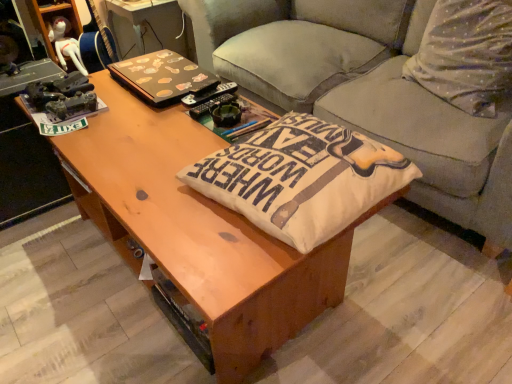
Question: Does gray fabric couch at center have a larger size compared to white cotton pillow at upper right, marked as the second throw pillow in a left-to-right arrangement?

Choices:
 (A) yes
 (B) no

Answer: (A)

Question: Is gray fabric couch at center thinner than white cotton pillow at upper right, the first throw pillow viewed from the right?

Choices:
 (A) yes
 (B) no

Answer: (B)

Question: From a real-world perspective, is gray fabric couch at center beneath white cotton pillow at upper right, which is the second throw pillow from bottom to top?

Choices:
 (A) no
 (B) yes

Answer: (B)

Question: Considering the relative sizes of gray fabric couch at center and white cotton pillow at upper right, acting as the first throw pillow starting from the back, in the image provided, is gray fabric couch at center shorter than white cotton pillow at upper right, acting as the first throw pillow starting from the back,?

Choices:
 (A) no
 (B) yes

Answer: (A)

Question: Considering the relative sizes of gray fabric couch at center and white cotton pillow at upper right, which is the second throw pillow from bottom to top, in the image provided, is gray fabric couch at center smaller than white cotton pillow at upper right, which is the second throw pillow from bottom to top,?

Choices:
 (A) no
 (B) yes

Answer: (A)

Question: Considering the positions of point (313, 147) and point (263, 21), is point (313, 147) closer or farther from the camera than point (263, 21)?

Choices:
 (A) farther
 (B) closer

Answer: (B)

Question: Considering their positions, is beige fabric cushion at center, marked as the 2th throw pillow in a top-to-bottom arrangement, located in front of or behind gray fabric couch at center?

Choices:
 (A) behind
 (B) front

Answer: (B)

Question: Considering the positions of beige fabric cushion at center, marked as the first throw pillow in a bottom-to-top arrangement, and gray fabric couch at center in the image, is beige fabric cushion at center, marked as the first throw pillow in a bottom-to-top arrangement, wider or thinner than gray fabric couch at center?

Choices:
 (A) thin
 (B) wide

Answer: (A)

Question: Based on their sizes in the image, would you say beige fabric cushion at center, which is the 1th throw pillow from front to back, is bigger or smaller than gray fabric couch at center?

Choices:
 (A) big
 (B) small

Answer: (B)

Question: In terms of width, does brown matte laptop at upper center look wider or thinner when compared to white cotton pillow at upper right, which is the second throw pillow from bottom to top?

Choices:
 (A) thin
 (B) wide

Answer: (B)

Question: Is point (207, 82) closer or farther from the camera than point (458, 92)?

Choices:
 (A) farther
 (B) closer

Answer: (B)

Question: In terms of height, does brown matte laptop at upper center look taller or shorter compared to white cotton pillow at upper right, the first throw pillow viewed from the right?

Choices:
 (A) short
 (B) tall

Answer: (A)

Question: Considering the relative positions of brown matte laptop at upper center and white cotton pillow at upper right, which appears as the 1th throw pillow when viewed from the top, in the image provided, is brown matte laptop at upper center to the left or to the right of white cotton pillow at upper right, which appears as the 1th throw pillow when viewed from the top,?

Choices:
 (A) left
 (B) right

Answer: (A)

Question: Would you say white cotton pillow at upper right, marked as the second throw pillow in a left-to-right arrangement, is to the left or to the right of brown matte laptop at upper center in the picture?

Choices:
 (A) left
 (B) right

Answer: (B)

Question: Is point (500, 74) closer or farther from the camera than point (118, 72)?

Choices:
 (A) farther
 (B) closer

Answer: (B)